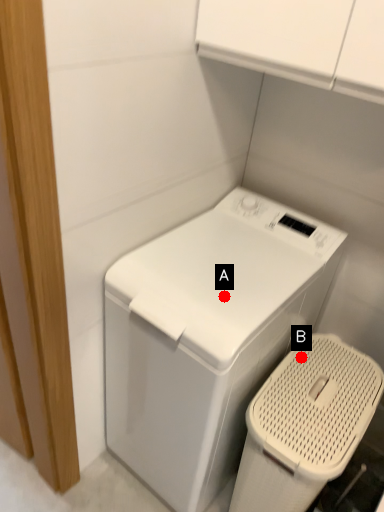
Question: Two points are circled on the image, labeled by A and B beside each circle. Which point is closer to the camera taking this photo?

Choices:
 (A) A is closer
 (B) B is closer

Answer: (A)